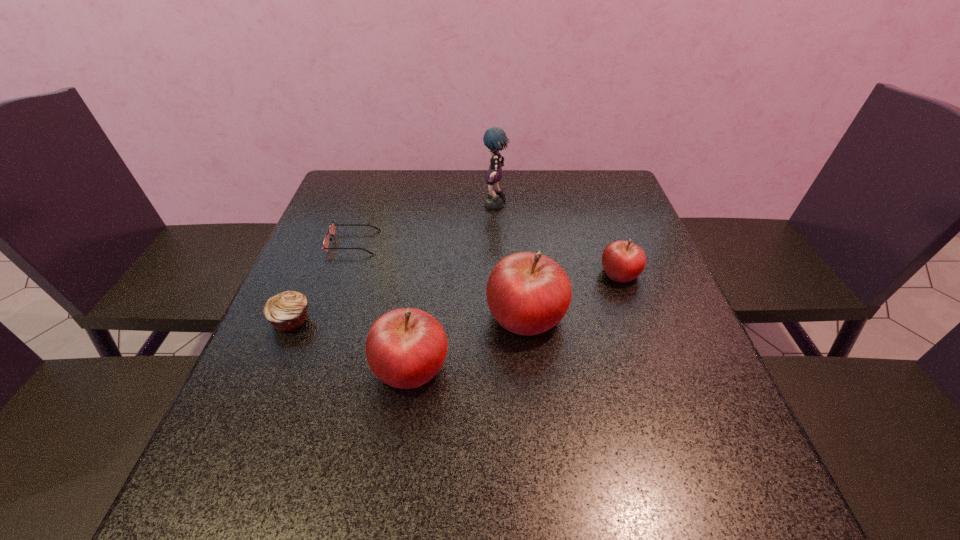
Locate an element on the screen. The image size is (960, 540). vacant space that satisfies the following two spatial constraints: 1. on the bridge of the shortest object; 2. on the back side of the third shortest object is located at coordinates (343, 273).

Where is `free region that satisfies the following two spatial constraints: 1. on the back side of the muffin; 2. on the right side of the third farthest object`? free region that satisfies the following two spatial constraints: 1. on the back side of the muffin; 2. on the right side of the third farthest object is located at coordinates 311,273.

Identify the location of free space that satisfies the following two spatial constraints: 1. on the bridge of the second apple from right to left; 2. on the right side of the shortest object. The height and width of the screenshot is (540, 960). (327, 315).

The width and height of the screenshot is (960, 540). In order to click on free location that satisfies the following two spatial constraints: 1. on the front-facing side of the tallest object; 2. on the front side of the fourth shortest object in this screenshot , I will do `click(503, 367)`.

I want to click on free location that satisfies the following two spatial constraints: 1. on the back side of the farthest apple; 2. on the left side of the fifth tallest object, so click(x=311, y=273).

Locate an element on the screen. The image size is (960, 540). free point that satisfies the following two spatial constraints: 1. on the front-facing side of the second apple from right to left; 2. on the right side of the tallest object is located at coordinates (500, 315).